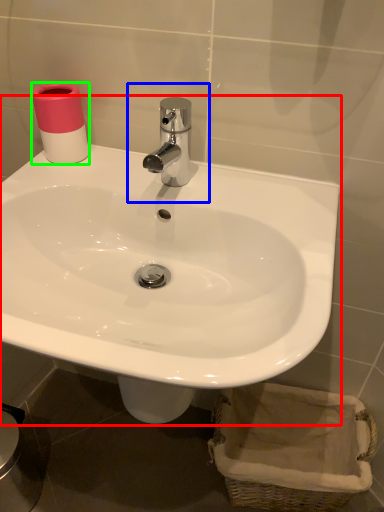
Question: Which object is the closest to the sink (highlighted by a red box)? Choose among these: plumbing fixture (highlighted by a blue box) or toilet paper (highlighted by a green box).

Choices:
 (A) plumbing fixture
 (B) toilet paper

Answer: (A)